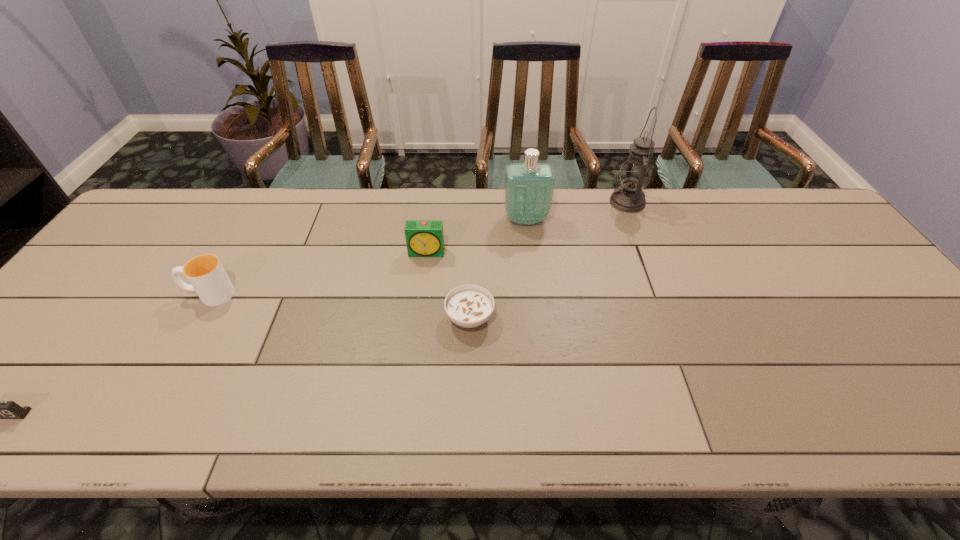
Where is `vacant space that satisfies the following two spatial constraints: 1. on the front-facing side of the soup bowl; 2. on the left side of the right alarm clock`? This screenshot has height=540, width=960. vacant space that satisfies the following two spatial constraints: 1. on the front-facing side of the soup bowl; 2. on the left side of the right alarm clock is located at coordinates (420, 318).

The height and width of the screenshot is (540, 960). Find the location of `free region that satisfies the following two spatial constraints: 1. on the front-facing side of the fourth object from left to right; 2. on the left side of the right alarm clock`. free region that satisfies the following two spatial constraints: 1. on the front-facing side of the fourth object from left to right; 2. on the left side of the right alarm clock is located at coordinates (420, 318).